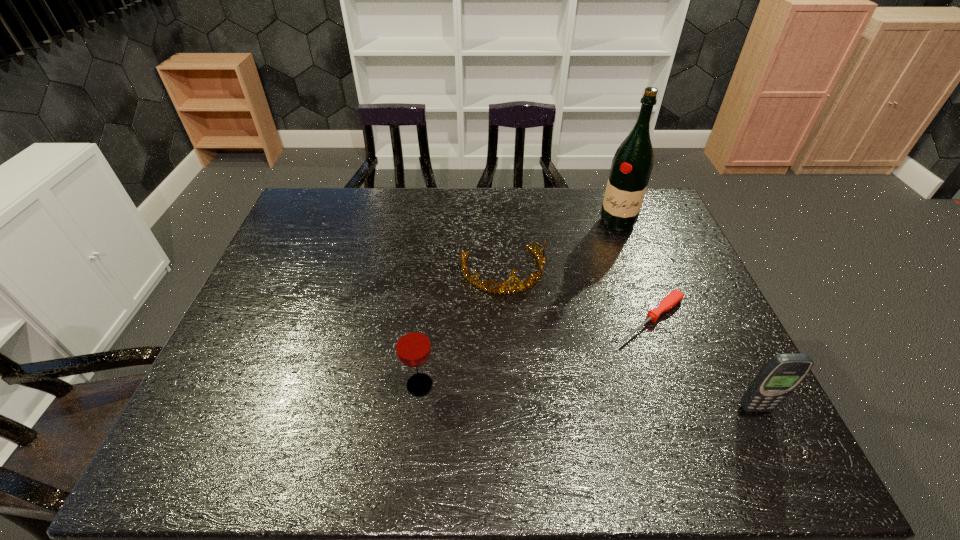
Locate an element on the screen. The height and width of the screenshot is (540, 960). glass that is at the near edge is located at coordinates (412, 343).

Locate an element on the screen. The width and height of the screenshot is (960, 540). cellular telephone that is at the near edge is located at coordinates 781,375.

Image resolution: width=960 pixels, height=540 pixels. Find the location of `cellular telephone that is at the right edge`. cellular telephone that is at the right edge is located at coordinates (781, 375).

At what (x,y) coordinates should I click in order to perform the action: click on liquor present at the right edge. Please return your answer as a coordinate pair (x, y). Looking at the image, I should click on pyautogui.click(x=631, y=167).

This screenshot has width=960, height=540. Find the location of `screwdriver that is at the right edge`. screwdriver that is at the right edge is located at coordinates (675, 297).

Find the location of a particular element. The width and height of the screenshot is (960, 540). object that is at the far right corner is located at coordinates (631, 167).

The height and width of the screenshot is (540, 960). I want to click on object that is at the near right corner, so 781,375.

Identify the location of vacant point at the far edge. This screenshot has height=540, width=960. (457, 215).

I want to click on vacant space at the left edge of the desktop, so click(x=276, y=306).

Image resolution: width=960 pixels, height=540 pixels. In the image, there is a desktop. In order to click on vacant space at the right edge in this screenshot , I will do `click(651, 230)`.